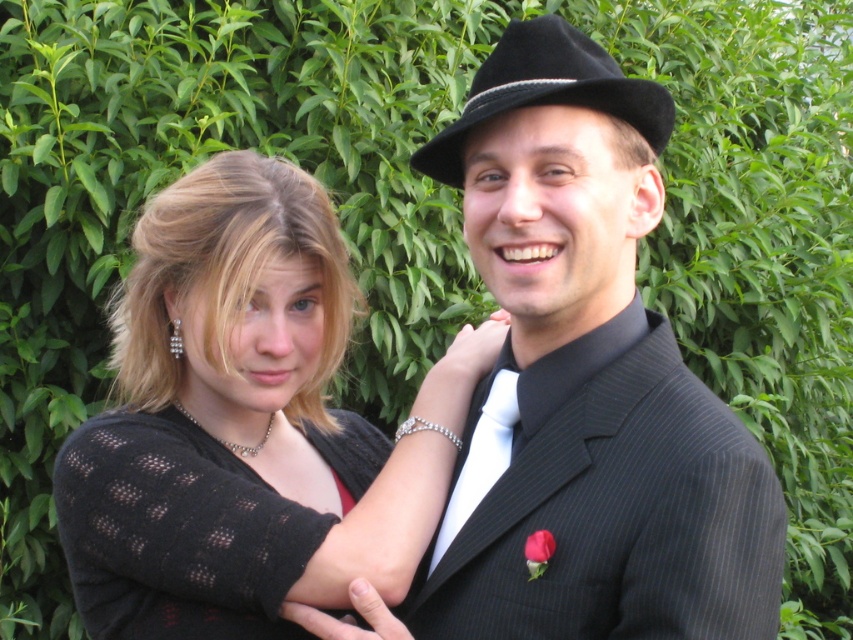
You are a photographer standing 1.5 meters away from the camera. You want to adjust the focus ring on the black pinstripe suit at center. Can you reach it without moving your position?

The black pinstripe suit at center and camera are 1.28 meters apart from each other. Since you are 1.5 meters away from the camera, the total distance between you and the black pinstripe suit at center is 2.78 meters. This distance is too far to reach the focus ring without moving closer.

You are a photographer trying to focus on the black textured sweater at left in the image. What are the coordinates where you should adjust your camera lens to capture it?

The black textured sweater at left is located at coordinates point (247, 422). Adjust your camera lens to that point to capture it.

You are a photographer adjusting the camera settings to capture the two people in the scene. The camera has a focus range of 7 inches. Can you focus on both the black pinstripe suit at center and the white satin tie at center simultaneously?

The black pinstripe suit at center is 7.26 inches from the white satin tie at center. Since the focus range is 7 inches, the distance between them exceeds the camera focus range. Therefore, you cannot focus on both the black pinstripe suit at center and the white satin tie at center at the same time.